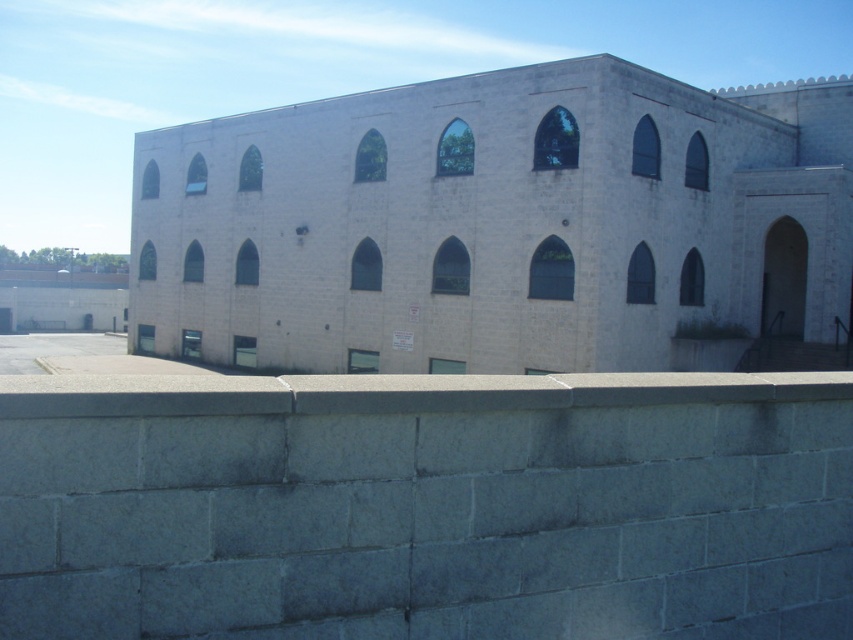
You are standing in front of the building and want to determine which of the two points, point [808,461] or point [225,396], is closer to you. Based on the building structure, which point is nearer?

Point [808,461] is further to the viewer than point [225,396]. Therefore, point [225,396] is closer to you.

You are an architect analyzing the building. You observe the white stone church at center and the gray concrete ledge at center. Which object occupies more space in the scene?

The white stone church at center is bigger than the gray concrete ledge at center, so it occupies more space in the scene.

You are a delivery person trying to park your 2.5 meter wide truck. You see the gray concrete ledge at lower center and the white stone church at center. Which parking spot can accommodate your truck?

The gray concrete ledge at lower center has a width less than the white stone church at center, so the white stone church at center can accommodate the 2.5 meter wide truck.